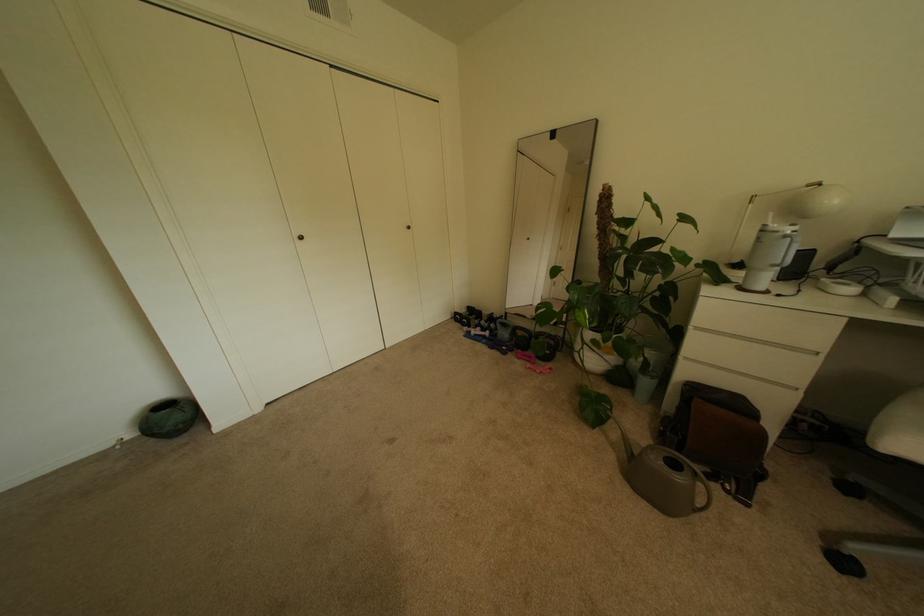
This screenshot has height=616, width=924. I want to click on white cup handle, so click(x=792, y=244).